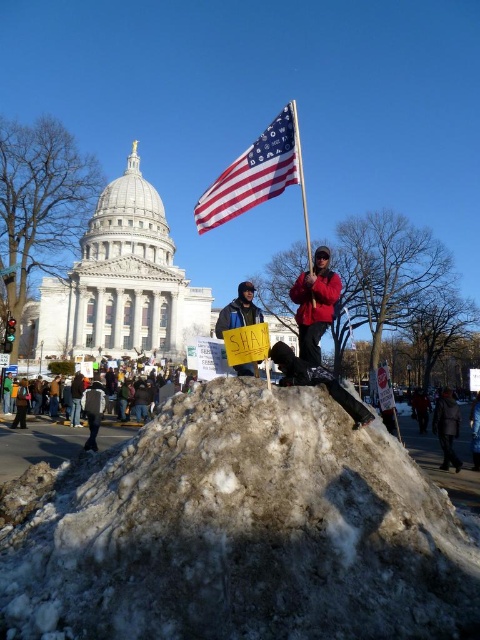
Is white frosty mound at center above dark blue jacket at center?

Incorrect, white frosty mound at center is not positioned above dark blue jacket at center.

Is white frosty mound at center taller than dark blue jacket at center?

Yes.

Describe the element at coordinates (241, 531) in the screenshot. I see `white frosty mound at center` at that location.

In order to click on white frosty mound at center in this screenshot , I will do `click(241, 531)`.

Which is above, white frosty mound at center or dark gray coat at lower right?

dark gray coat at lower right

Can you confirm if white frosty mound at center is positioned above dark gray coat at lower right?

No, white frosty mound at center is not above dark gray coat at lower right.

Measure the distance between white frosty mound at center and camera.

white frosty mound at center and camera are 47.57 meters apart.

The width and height of the screenshot is (480, 640). I want to click on white frosty mound at center, so click(241, 531).

From the picture: Is american flag at center taller than dark brown fabric crowd at lower center?

Indeed, american flag at center has a greater height compared to dark brown fabric crowd at lower center.

Is american flag at center further to camera compared to dark brown fabric crowd at lower center?

No, it is in front of dark brown fabric crowd at lower center.

Which is behind, point (213, 220) or point (163, 394)?

Point (163, 394)

Identify the location of american flag at center. The height and width of the screenshot is (640, 480). (255, 173).